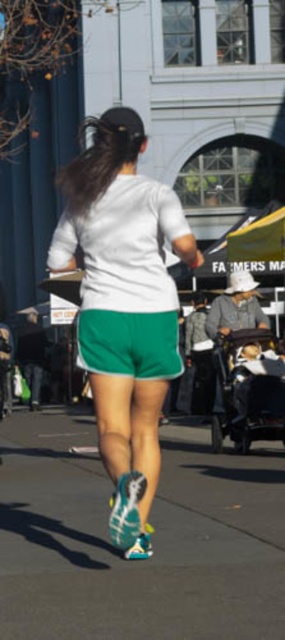
Looking at this image, you are a photographer trying to capture the runner in the image. You notice the gray asphalt at lower center and the white matte shorts at center. Which object is wider in the photo?

The gray asphalt at lower center is wider than the white matte shorts at center.

You are a delivery drone flying above the scene. You need to land at the point marked as point (x=153, y=540). What surface will you land on?

The point (x=153, y=540) is on gray asphalt at lower center, so the drone will land on gray asphalt.

Based on the photo, you are a photographer trying to capture the runner in the scene. You need to ensure that both the gray asphalt at lower center and the white matte shorts at center are visible in your photo. Given their sizes, which object should you focus on to ensure both are in frame?

The gray asphalt at lower center is larger than the white matte shorts at center. To ensure both are in frame, focus on the larger gray asphalt at lower center as it occupies more space, allowing the smaller white matte shorts at center to naturally fit into the composition.